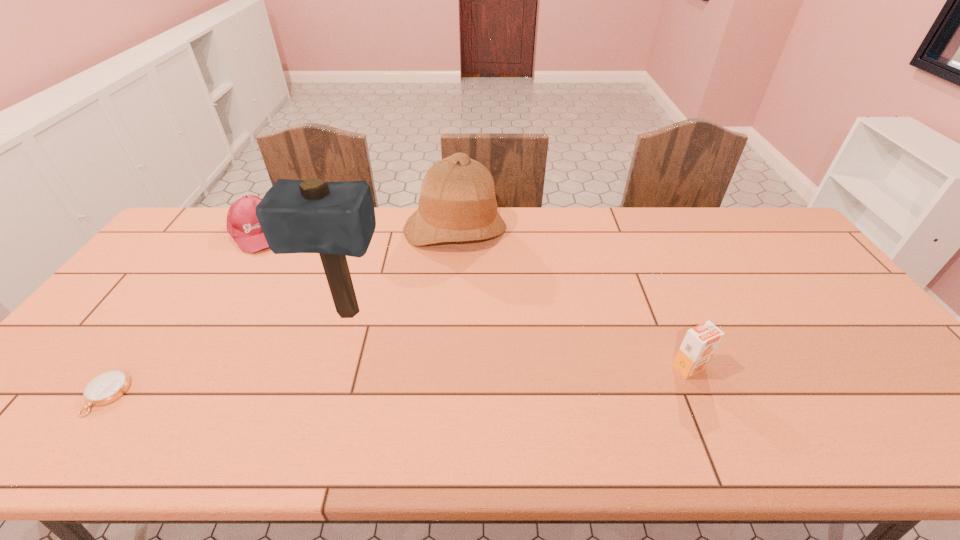
This screenshot has width=960, height=540. I want to click on the third closest object to the mallet, so coord(109,386).

The height and width of the screenshot is (540, 960). Identify the location of free space that satisfies the following two spatial constraints: 1. on the front side of the rightmost object; 2. on the left side of the tallest object. (330, 368).

You are a GUI agent. You are given a task and a screenshot of the screen. Output one action in this format:
    pyautogui.click(x=<x>, y=<y>)
    Task: Click on the blank space that satisfies the following two spatial constraints: 1. on the back side of the orange juice; 2. on the left side of the compass
    This screenshot has height=540, width=960.
    Given the screenshot: What is the action you would take?
    pyautogui.click(x=126, y=368)

In order to click on free spot that satisfies the following two spatial constraints: 1. on the front side of the second shortest object; 2. on the left side of the orange juice in this screenshot , I will do `click(172, 368)`.

The height and width of the screenshot is (540, 960). What are the coordinates of `free location that satisfies the following two spatial constraints: 1. on the back side of the hat; 2. on the left side of the second shortest object` in the screenshot? It's located at (258, 230).